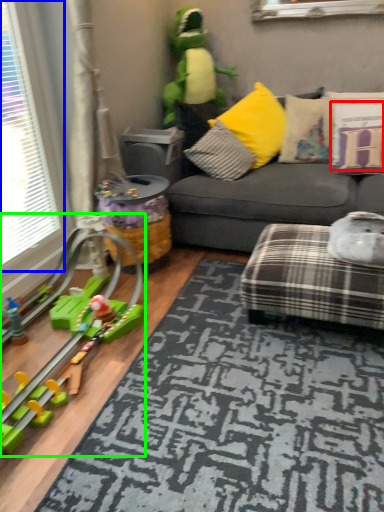
Question: Estimate the real-world distances between objects in this image. Which object is farther from pillow (highlighted by a red box), window (highlighted by a blue box) or toy (highlighted by a green box)?

Choices:
 (A) window
 (B) toy

Answer: (A)